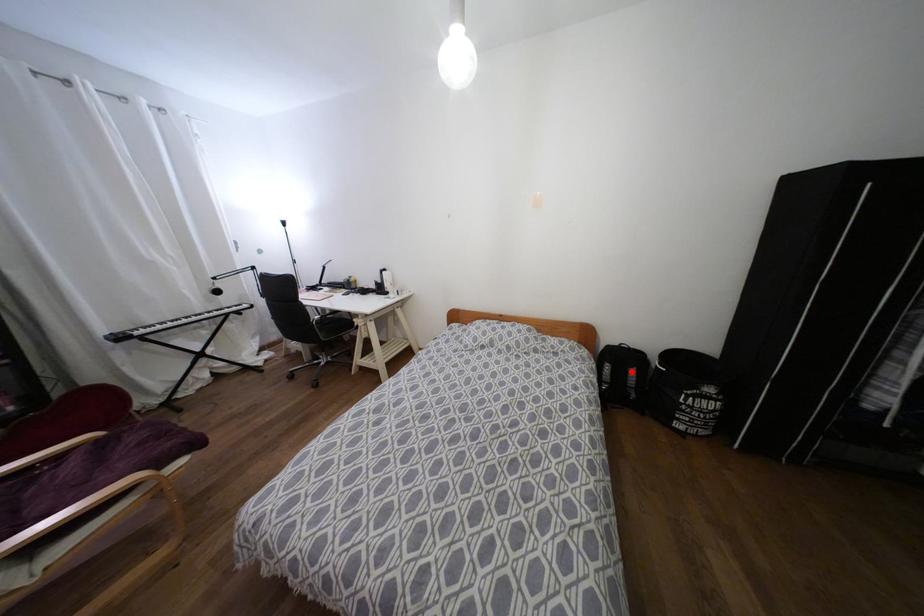
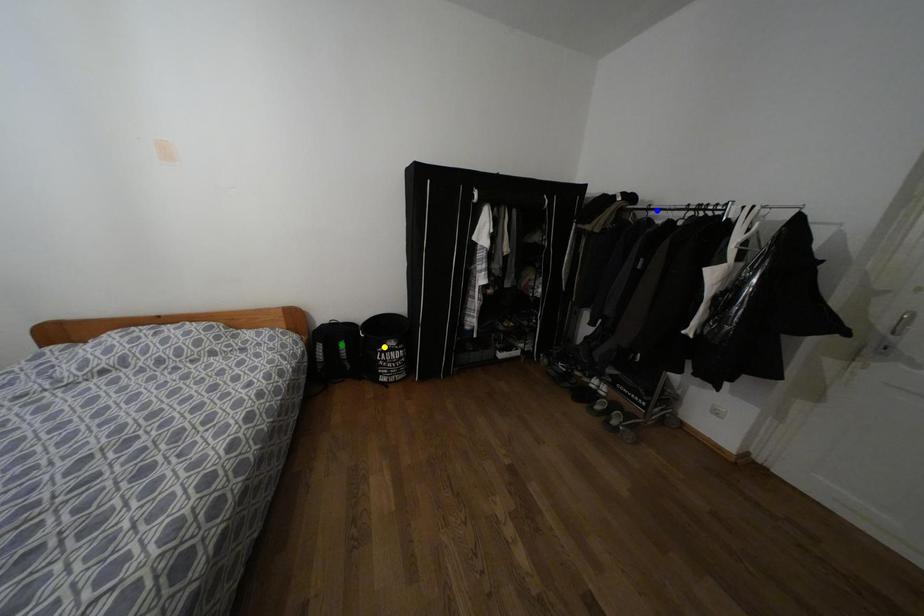
Question: I am providing you with two images of the same scene from different viewpoints. A red point is marked on the first image. You are given multiple points on the second image. Which point in image 2 is actually the same real-world point as the red point in image 1?

Choices:
 (A) green point
 (B) blue point
 (C) yellow point

Answer: (A)